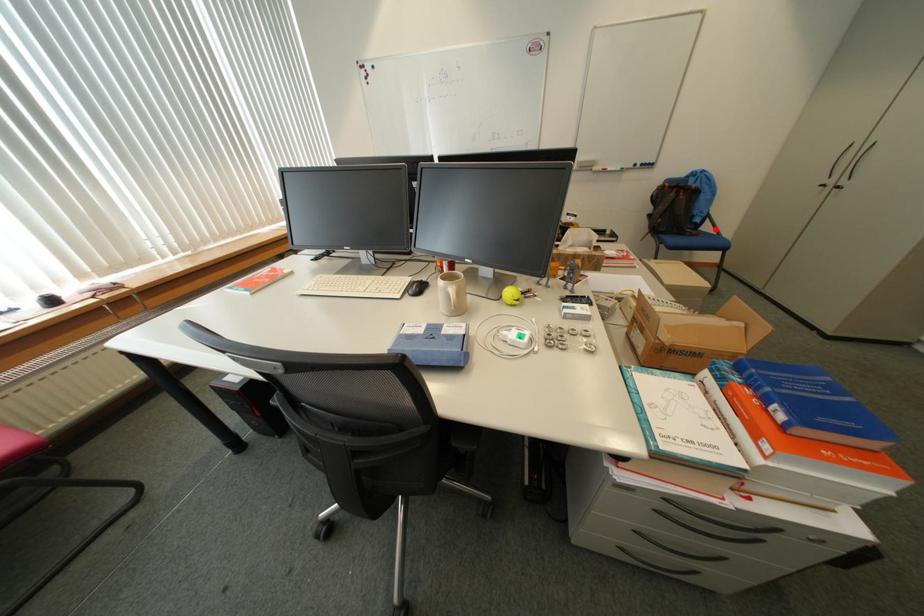
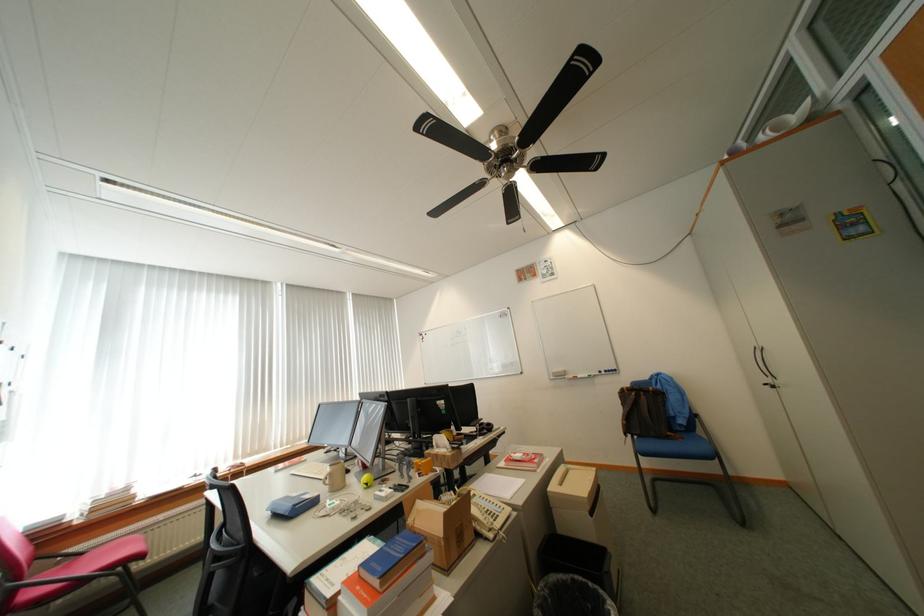
Question: A red point is marked in image1. In image2, is the corresponding 3D point closer to the camera or farther? Reply with the corresponding letter.

Choices:
 (A) The corresponding 3D point is closer.
 (B) The corresponding 3D point is farther.

Answer: (B)